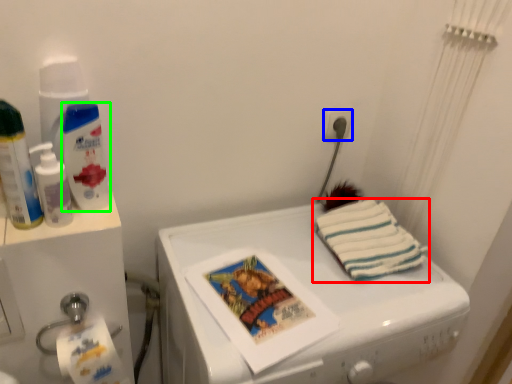
Question: Which is nearer to the towel/napkin (highlighted by a red box)? power plugs and sockets (highlighted by a blue box) or cleaning product (highlighted by a green box).

Choices:
 (A) power plugs and sockets
 (B) cleaning product

Answer: (A)